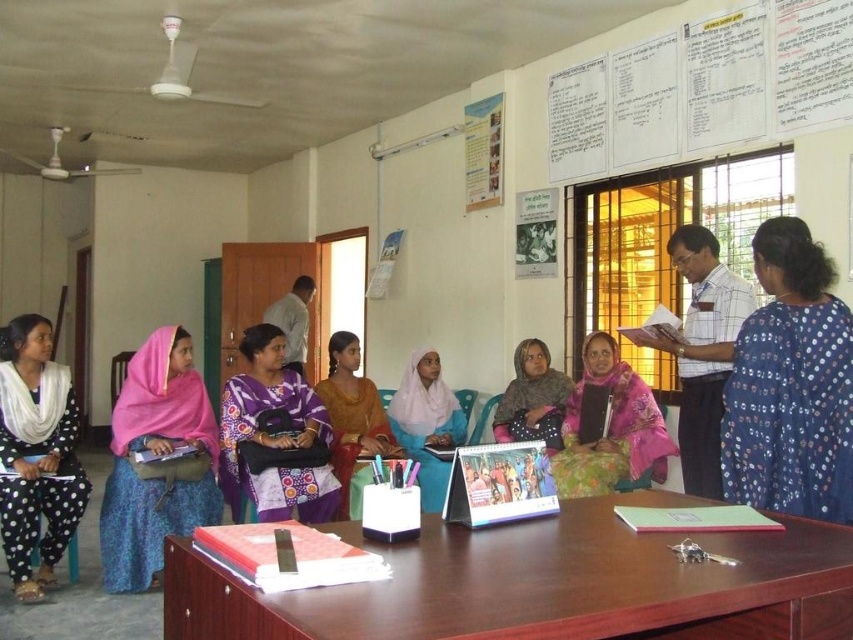
You are organizing a photo shoot and need to arrange the black polka dot dress at left and the orange fabric dress at center based on their widths. Which dress should you place on the narrower side of the frame to ensure proper composition?

The black polka dot dress at left is thinner than the orange fabric dress at center, so it should be placed on the narrower side of the frame.

You are attending a meeting in this room and need to locate the blue dotted saree at right and the matte pink scarf at center. From the perspective of someone sitting at the front of the room, which object is positioned higher?

The blue dotted saree at right is above the matte pink scarf at center, so from the front of the room perspective, the blue dotted saree at right is positioned higher.

You are attending a meeting and need to find the orange fabric dress at center. Which direction should you look from the black polka dot dress at left?

The orange fabric dress at center is to the right of the black polka dot dress at left.